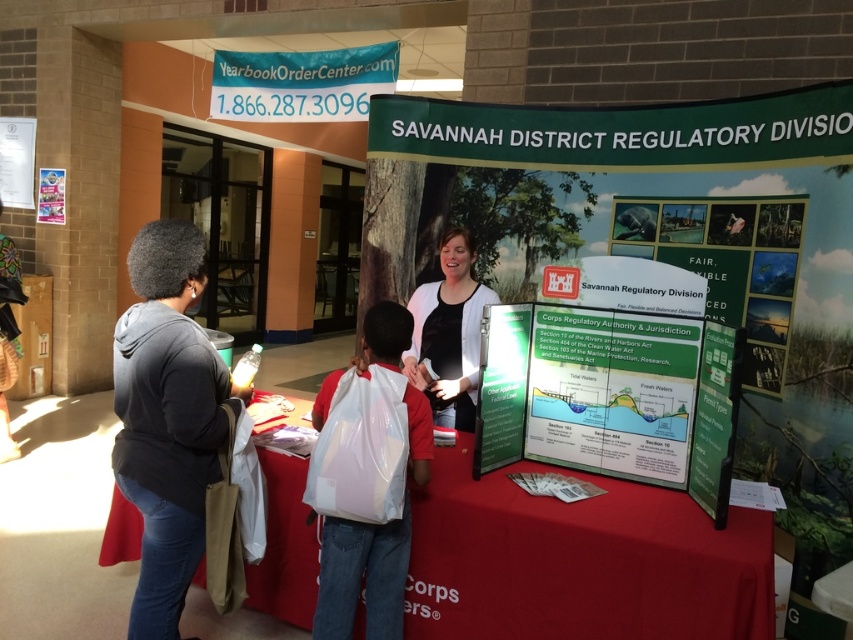
Which of these two, green fabric banner at center or red fabric table at center, stands shorter?

Standing shorter between the two is red fabric table at center.

Is point (689, 243) positioned in front of point (572, 556)?

No.

You are a GUI agent. You are given a task and a screenshot of the screen. Output one action in this format:
    pyautogui.click(x=<x>, y=<y>)
    Task: Click on the green fabric banner at center
    Image resolution: width=853 pixels, height=640 pixels.
    Given the screenshot: What is the action you would take?
    pyautogui.click(x=685, y=246)

Does green fabric banner at center appear on the right side of dark gray hoodie at left?

Indeed, green fabric banner at center is positioned on the right side of dark gray hoodie at left.

Is green fabric banner at center taller than dark gray hoodie at left?

Correct, green fabric banner at center is much taller as dark gray hoodie at left.

Is point (726, 253) farther from viewer compared to point (155, 522)?

That is True.

Locate an element on the screen. This screenshot has height=640, width=853. green fabric banner at center is located at coordinates click(685, 246).

Does white plastic bag at center have a lesser width compared to white paper poster at center?

No, white plastic bag at center is not thinner than white paper poster at center.

Can you confirm if white plastic bag at center is positioned above white paper poster at center?

Incorrect, white plastic bag at center is not positioned above white paper poster at center.

Identify the location of white plastic bag at center. The width and height of the screenshot is (853, 640). (346, 572).